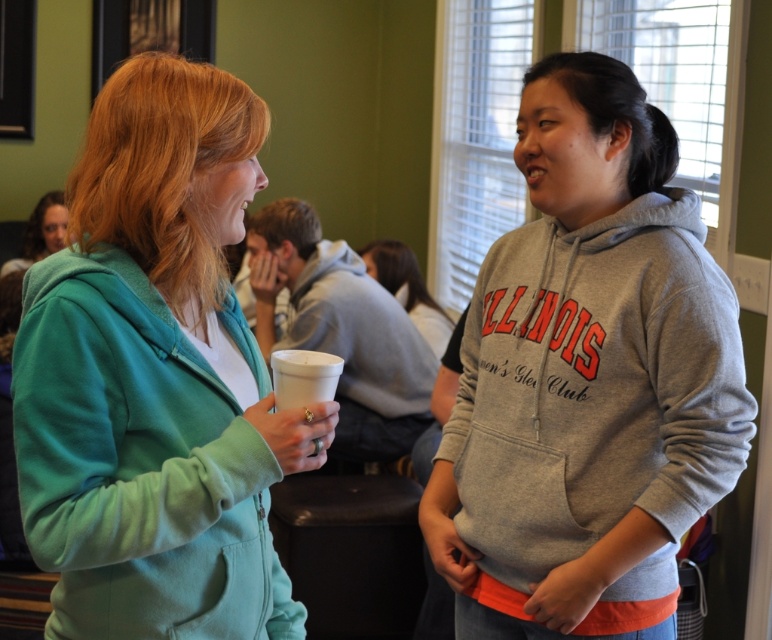
Who is more forward, (x=496, y=518) or (x=394, y=284)?

Point (x=496, y=518) is more forward.

Is gray fleece hoodie at right bigger than gray fleece hoodie at center?

Yes.

Between point (596, 406) and point (407, 248), which one is positioned behind?

Positioned behind is point (407, 248).

The width and height of the screenshot is (772, 640). What are the coordinates of `gray fleece hoodie at right` in the screenshot? It's located at (587, 378).

What do you see at coordinates (156, 376) in the screenshot? I see `matte green hoodie at left` at bounding box center [156, 376].

Does point (90, 433) come in front of point (359, 323)?

That is True.

Is point (195, 502) positioned after point (368, 310)?

No.

Where is `matte green hoodie at left`? The image size is (772, 640). matte green hoodie at left is located at coordinates (156, 376).

Can you confirm if white matte cup at center is positioned above white styrofoam cup at center?

Indeed, white matte cup at center is positioned over white styrofoam cup at center.

Who is more distant from viewer, (x=373, y=310) or (x=320, y=374)?

Positioned behind is point (x=373, y=310).

Between point (400, 416) and point (293, 376), which one is positioned behind?

Point (400, 416)

Find the location of a particular element. This screenshot has height=640, width=772. white matte cup at center is located at coordinates (340, 330).